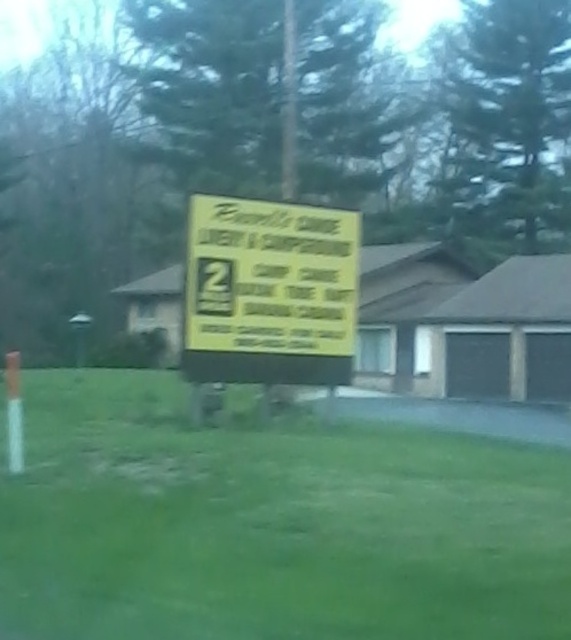
Question: Which of the following is the farthest from the observer?

Choices:
 (A) (560, 568)
 (B) (256, 244)

Answer: (B)

Question: Is green grass at center closer to the viewer compared to yellow paper sign at center?

Choices:
 (A) yes
 (B) no

Answer: (A)

Question: Does green grass at center appear over yellow paper sign at center?

Choices:
 (A) yes
 (B) no

Answer: (B)

Question: Is green grass at center to the left of yellow paper sign at center from the viewer's perspective?

Choices:
 (A) yes
 (B) no

Answer: (A)

Question: Which point is closer to the camera?

Choices:
 (A) tap(513, 570)
 (B) tap(323, 208)

Answer: (A)